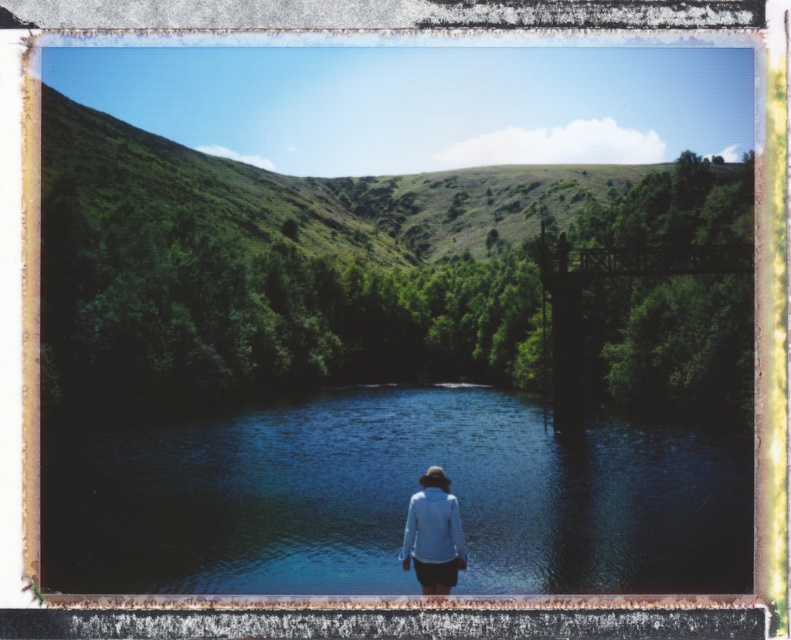
You are standing at the edge of the water and want to walk towards the green grassy hillside at upper center. Which direction should you head relative to the blue reflective water at center?

The green grassy hillside at upper center is to the left of the blue reflective water at center, so you should head to the left of the blue reflective water at center to reach it.

You are a photographer planning to take a landscape photo of the green grassy hillside at upper center and the blue reflective water at center. Which object should you focus on first if you want to capture both in a single shot without moving the camera?

The green grassy hillside at upper center is above the blue reflective water at center, so you should focus on the green grassy hillside at upper center first to ensure it is in sharp focus before the water.

You are a photographer planning to take a landscape photo of the green grassy hillside at upper center and the blue reflective water at center. Which object will appear closer to the camera in the photo?

The green grassy hillside at upper center will appear closer to the camera because it is in front of the blue reflective water at center, as stated in the description.